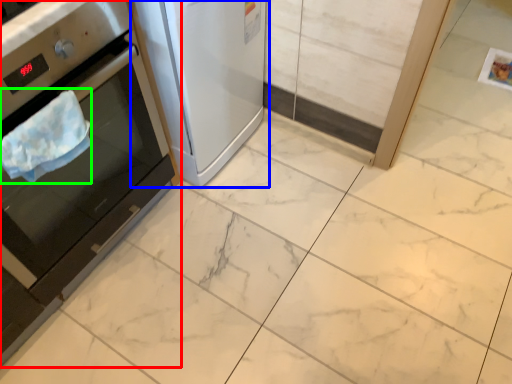
Question: Considering the real-world distances, which object is closest to home appliance (highlighted by a red box)? home appliance (highlighted by a blue box) or blanket (highlighted by a green box).

Choices:
 (A) home appliance
 (B) blanket

Answer: (B)